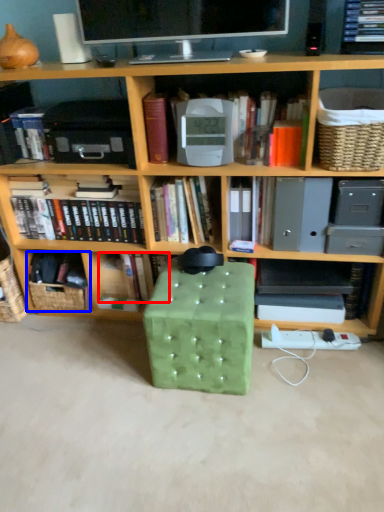
Question: Which object is closer to the camera taking this photo, book (highlighted by a red box) or basket (highlighted by a blue box)?

Choices:
 (A) book
 (B) basket

Answer: (B)